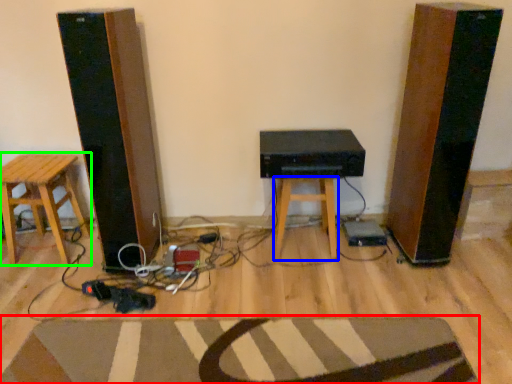
Question: Which object is the farthest from doormat (highlighted by a red box)? Choose among these: stool (highlighted by a blue box) or stool (highlighted by a green box).

Choices:
 (A) stool
 (B) stool

Answer: (B)